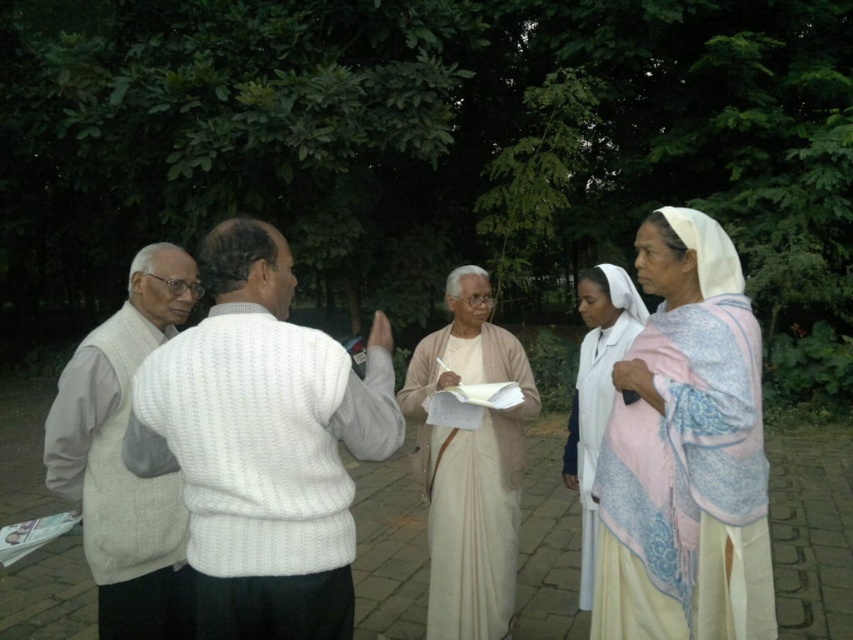
Question: Among these points, which one is farthest from the camera?

Choices:
 (A) (641, 243)
 (B) (314, 371)
 (C) (578, 368)
 (D) (425, 337)

Answer: (D)

Question: Can you confirm if white knitted sweater at center is positioned below light beige fabric at center?

Choices:
 (A) no
 (B) yes

Answer: (A)

Question: Which point is farther from the camera taking this photo?

Choices:
 (A) (479, 273)
 (B) (338, 593)
 (C) (679, 333)
 (D) (589, 353)

Answer: (A)

Question: Which point appears closest to the camera in this image?

Choices:
 (A) (236, 378)
 (B) (83, 381)
 (C) (608, 378)

Answer: (A)

Question: Can you confirm if gray knitted sweater vest at left is bigger than white cloth at right?

Choices:
 (A) no
 (B) yes

Answer: (B)

Question: Can you confirm if white silk saree at right is positioned to the left of light beige fabric at center?

Choices:
 (A) yes
 (B) no

Answer: (B)